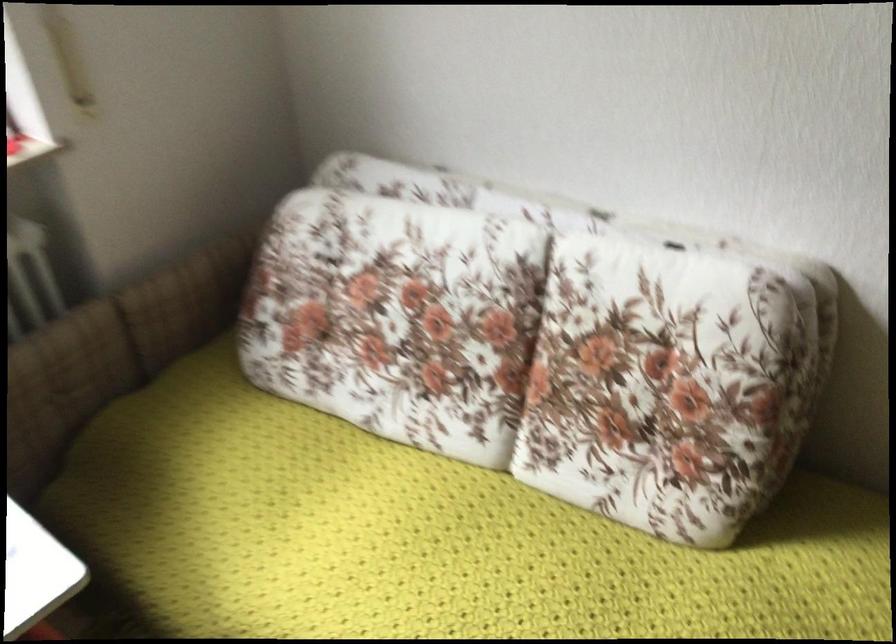
Describe the element at coordinates (429, 538) in the screenshot. I see `a sofa sitting surface` at that location.